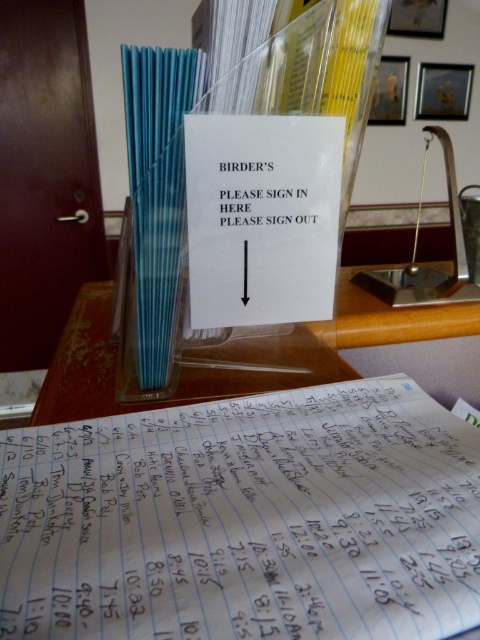
You are a birder visiting the site and need to sign in. You see the blue lined paper at center and the white paper sign at center on the desk. Which item should you use to record your check in, and why?

The blue lined paper at center is taller than the white paper sign at center. Therefore, the blue lined paper at center is the logbook where you should record your check in, as it is designed for entries with times and names, while the white paper sign provides instructions.

From the picture: You are standing at the desk and want to reach a point that is exactly 20 inches away from you. Is the point at coordinate point [308,148] within that range?

The distance of point [308,148] from camera is 18.47 inches, so the point is within 20 inches range.

You are a birder visiting the site and need to sign in. You see the blue lined paper at center and the white paper sign at center on the desk. Which item should you write your name on, and why?

You should write your name on the blue lined paper at center because the white paper sign at center directs visitors to sign in and out at this location, and the blue lined paper at center is the larger one where entries are likely recorded.